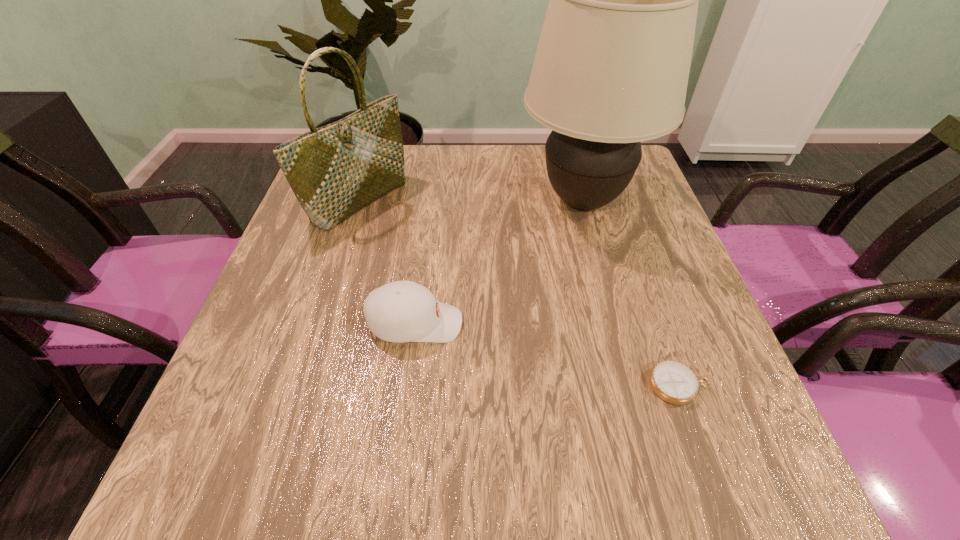
I want to click on vacant area at the right edge, so click(x=669, y=339).

Image resolution: width=960 pixels, height=540 pixels. I want to click on vacant area at the near right corner of the desktop, so click(x=730, y=447).

Locate an element on the screen. vacant area that lies between the lampshade and the second nearest object is located at coordinates (499, 262).

Locate an element on the screen. vacant space in between the tallest object and the shortest object is located at coordinates (632, 293).

At what (x,y) coordinates should I click in order to perform the action: click on free spot between the shopping bag and the tallest object. Please return your answer as a coordinate pair (x, y). Looking at the image, I should click on [471, 201].

Image resolution: width=960 pixels, height=540 pixels. I want to click on vacant point located between the compass and the shopping bag, so click(x=519, y=293).

At what (x,y) coordinates should I click in order to perform the action: click on unoccupied area between the tallest object and the shortest object. Please return your answer as a coordinate pair (x, y). The width and height of the screenshot is (960, 540). Looking at the image, I should click on (632, 293).

Find the location of `free space between the tallest object and the baseball cap`. free space between the tallest object and the baseball cap is located at coordinates 499,262.

The width and height of the screenshot is (960, 540). I want to click on free spot between the second tallest object and the lampshade, so click(471, 201).

What are the coordinates of `unoccupied area between the third shortest object and the third farthest object` in the screenshot? It's located at (388, 262).